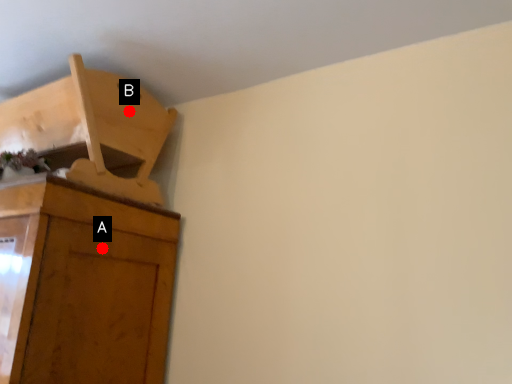
Question: Two points are circled on the image, labeled by A and B beside each circle. Which point is further to the camera?

Choices:
 (A) A is further
 (B) B is further

Answer: (B)